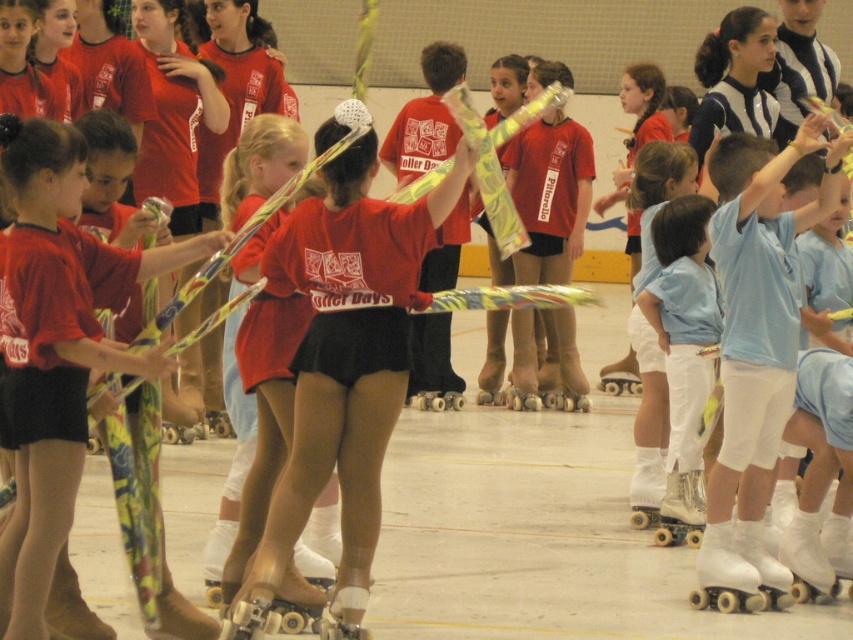
You are standing in the gymnasium and see two points marked in the image. Which point, point (x=785, y=333) or point (x=733, y=547), is closer to you?

Point (x=785, y=333) is closer to the viewer than point (x=733, y=547).

Consider the image. You are a photographer positioned at the back of the gymnasium. You want to take a photo of the white matte shorts at right and the white rubber roller skate at lower right. Which object should you focus on first if you want to capture both in a single shot without moving the camera?

You should focus on the white rubber roller skate at lower right first because it is closer to the camera than the white matte shorts at right, which is above it. This way, both objects will be in focus within the same frame.

You are a photographer positioned at the center of the gymnasium. You need to capture a photo of the white matte shorts at right and the white rubber roller skate at lower right. Which object should you focus on first if you want to ensure both are in the frame without moving the camera?

The white matte shorts at right is much taller than the white rubber roller skate at lower right, so you should focus on the white matte shorts at right first to ensure both are in the frame without moving the camera.